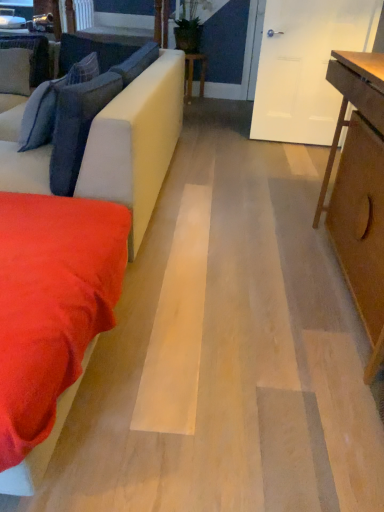
The width and height of the screenshot is (384, 512). I want to click on light brown wooden table at right, marked as the second table in a back-to-front arrangement, so click(x=354, y=102).

This screenshot has width=384, height=512. What do you see at coordinates (31, 54) in the screenshot? I see `suede-like gray pillow at upper left, which is the fourth pillow in front-to-back order` at bounding box center [31, 54].

Find the location of a particular element. The width and height of the screenshot is (384, 512). dark blue fabric pillow at left, arranged as the second pillow when viewed from the front is located at coordinates (51, 104).

Describe the element at coordinates (93, 50) in the screenshot. The image size is (384, 512). I see `velvet blue pillow at upper left, which appears as the third pillow when viewed from the front` at that location.

The image size is (384, 512). What do you see at coordinates (56, 303) in the screenshot?
I see `suede-like red blanket at lower left` at bounding box center [56, 303].

This screenshot has height=512, width=384. I want to click on light brown wooden table at right, marked as the second table in a back-to-front arrangement, so click(354, 102).

Considering the sizes of objects velvet blue pillow at upper left, the second pillow positioned from the back, and dark blue fabric pillow at left, acting as the 3th pillow starting from the back, in the image provided, who is taller, velvet blue pillow at upper left, the second pillow positioned from the back, or dark blue fabric pillow at left, acting as the 3th pillow starting from the back,?

dark blue fabric pillow at left, acting as the 3th pillow starting from the back.

Would you say velvet blue pillow at upper left, the second pillow positioned from the back, is inside or outside dark blue fabric pillow at left, arranged as the second pillow when viewed from the front?

velvet blue pillow at upper left, the second pillow positioned from the back, cannot be found inside dark blue fabric pillow at left, arranged as the second pillow when viewed from the front.

Is velvet blue pillow at upper left, which appears as the third pillow when viewed from the front, looking in the opposite direction of dark blue fabric pillow at left, arranged as the second pillow when viewed from the front?

No, velvet blue pillow at upper left, which appears as the third pillow when viewed from the front, is not facing the opposite direction of dark blue fabric pillow at left, arranged as the second pillow when viewed from the front.

Considering the sizes of objects velvet blue pillow at upper left, which appears as the third pillow when viewed from the front, and dark blue fabric pillow at left, arranged as the second pillow when viewed from the front, in the image provided, who is smaller, velvet blue pillow at upper left, which appears as the third pillow when viewed from the front, or dark blue fabric pillow at left, arranged as the second pillow when viewed from the front,?

Smaller between the two is velvet blue pillow at upper left, which appears as the third pillow when viewed from the front.

From the image's perspective, between suede-like gray pillow at upper left, which is the first pillow in back-to-front order, and velvet blue pillow at upper left, which appears as the third pillow when viewed from the front, who is located below?

velvet blue pillow at upper left, which appears as the third pillow when viewed from the front, from the image's perspective.

Is suede-like gray pillow at upper left, which is the fourth pillow in front-to-back order, facing away from velvet blue pillow at upper left, the second pillow positioned from the back?

suede-like gray pillow at upper left, which is the fourth pillow in front-to-back order, does not have its back to velvet blue pillow at upper left, the second pillow positioned from the back.

Does suede-like gray pillow at upper left, which is the fourth pillow in front-to-back order, have a greater height compared to velvet blue pillow at upper left, which appears as the third pillow when viewed from the front?

Correct, suede-like gray pillow at upper left, which is the fourth pillow in front-to-back order, is much taller as velvet blue pillow at upper left, which appears as the third pillow when viewed from the front.

Is suede-like gray pillow at upper left, which is the fourth pillow in front-to-back order, beside velvet blue pillow at upper left, the second pillow positioned from the back?

No.

Consider the image. Does wooden table at center, which appears as the first table when viewed from the back, have a lesser width compared to dark blue fabric pillow at left, acting as the 3th pillow starting from the back?

In fact, wooden table at center, which appears as the first table when viewed from the back, might be wider than dark blue fabric pillow at left, acting as the 3th pillow starting from the back.

Is there a large distance between wooden table at center, placed as the 2th table when sorted from bottom to top, and dark blue fabric pillow at left, arranged as the second pillow when viewed from the front?

wooden table at center, placed as the 2th table when sorted from bottom to top, is far away from dark blue fabric pillow at left, arranged as the second pillow when viewed from the front.

The height and width of the screenshot is (512, 384). I want to click on pillow that is the 2nd one when counting leftward from the wooden table at center, arranged as the 2th table when viewed from the right, so click(x=51, y=104).

Measure the distance between wooden table at center, which is counted as the 1th table, starting from the left, and dark blue fabric pillow at left, arranged as the second pillow when viewed from the front.

They are 8.31 feet apart.

From a real-world perspective, relative to dark blue fabric pillow at left, acting as the 3th pillow starting from the back, is suede-like red blanket at lower left vertically above or below?

In terms of real-world spatial position, suede-like red blanket at lower left is below dark blue fabric pillow at left, acting as the 3th pillow starting from the back.

Can you confirm if suede-like red blanket at lower left is wider than dark blue fabric pillow at left, arranged as the second pillow when viewed from the front?

Yes, suede-like red blanket at lower left is wider than dark blue fabric pillow at left, arranged as the second pillow when viewed from the front.

Is suede-like red blanket at lower left shorter than dark blue fabric pillow at left, arranged as the second pillow when viewed from the front?

Yes.

Can you confirm if suede-like red blanket at lower left is bigger than dark blue fabric pillow at left, acting as the 3th pillow starting from the back?

Correct, suede-like red blanket at lower left is larger in size than dark blue fabric pillow at left, acting as the 3th pillow starting from the back.

Could you measure the distance between velvety blue pillow at left, acting as the 4th pillow starting from the back, and velvet blue pillow at upper left, which appears as the third pillow when viewed from the front?

velvety blue pillow at left, acting as the 4th pillow starting from the back, and velvet blue pillow at upper left, which appears as the third pillow when viewed from the front, are 5.35 feet apart.

Which is less distant, (51, 161) or (93, 47)?

The point (51, 161) is more forward.

The image size is (384, 512). Identify the location of the 2nd pillow above when counting from the velvety blue pillow at left, acting as the 4th pillow starting from the back (from the image's perspective). (93, 50).

Who is more distant, velvety blue pillow at left, the first pillow in the front-to-back sequence, or velvet blue pillow at upper left, which appears as the third pillow when viewed from the front?

velvet blue pillow at upper left, which appears as the third pillow when viewed from the front, is more distant.

Is dark blue fabric pillow at left, arranged as the second pillow when viewed from the front, at the back of suede-like gray pillow at upper left, which is the fourth pillow in front-to-back order?

No, suede-like gray pillow at upper left, which is the fourth pillow in front-to-back order,'s orientation is not away from dark blue fabric pillow at left, arranged as the second pillow when viewed from the front.

Find the location of a particular element. Image resolution: width=384 pixels, height=512 pixels. the 2nd pillow counting from the left of the dark blue fabric pillow at left, acting as the 3th pillow starting from the back is located at coordinates (31, 54).

Is suede-like gray pillow at upper left, which is the first pillow in back-to-front order, inside or outside of dark blue fabric pillow at left, acting as the 3th pillow starting from the back?

suede-like gray pillow at upper left, which is the first pillow in back-to-front order, cannot be found inside dark blue fabric pillow at left, acting as the 3th pillow starting from the back.

Is suede-like gray pillow at upper left, which is the fourth pillow in front-to-back order, closer to camera compared to dark blue fabric pillow at left, arranged as the second pillow when viewed from the front?

No, the depth of suede-like gray pillow at upper left, which is the fourth pillow in front-to-back order, is greater than that of dark blue fabric pillow at left, arranged as the second pillow when viewed from the front.

Are velvet blue pillow at upper left, the second pillow positioned from the back, and velvety blue pillow at left, acting as the 4th pillow starting from the back, making contact?

There is a gap between velvet blue pillow at upper left, the second pillow positioned from the back, and velvety blue pillow at left, acting as the 4th pillow starting from the back.

Is velvet blue pillow at upper left, the second pillow positioned from the back, to the right of velvety blue pillow at left, acting as the 4th pillow starting from the back, from the viewer's perspective?

Incorrect, velvet blue pillow at upper left, the second pillow positioned from the back, is not on the right side of velvety blue pillow at left, acting as the 4th pillow starting from the back.

Which is in front, point (133, 51) or point (54, 156)?

The point (54, 156) is closer to the camera.

Which is behind, velvet blue pillow at upper left, which appears as the third pillow when viewed from the front, or velvety blue pillow at left, the first pillow in the front-to-back sequence?

Positioned behind is velvet blue pillow at upper left, which appears as the third pillow when viewed from the front.

From the image's perspective, count 1st pillows upward from the dark blue fabric pillow at left, arranged as the second pillow when viewed from the front, and point to it. Please provide its 2D coordinates.

[(93, 50)]

This screenshot has height=512, width=384. Identify the location of pillow that is on the left side of velvet blue pillow at upper left, the second pillow positioned from the back. (31, 54).

Based on their spatial positions, is suede-like gray pillow at upper left, which is the fourth pillow in front-to-back order, or suede-like beige couch at left closer to suede-like red blanket at lower left?

suede-like beige couch at left lies closer to suede-like red blanket at lower left than the other object.

From the image, which object appears to be nearer to velvety blue pillow at left, the first pillow in the front-to-back sequence, suede-like gray pillow at upper left, which is the first pillow in back-to-front order, or velvet blue pillow at upper left, the second pillow positioned from the back?

velvet blue pillow at upper left, the second pillow positioned from the back, lies closer to velvety blue pillow at left, the first pillow in the front-to-back sequence, than the other object.

When comparing their distances from velvety blue pillow at left, acting as the 4th pillow starting from the back, does light brown wooden table at right, marked as the second table in a back-to-front arrangement, or suede-like gray pillow at upper left, which is the fourth pillow in front-to-back order, seem further?

Among the two, suede-like gray pillow at upper left, which is the fourth pillow in front-to-back order, is located further to velvety blue pillow at left, acting as the 4th pillow starting from the back.

When comparing their distances from suede-like red blanket at lower left, does suede-like beige couch at left or velvety blue pillow at left, the first pillow in the front-to-back sequence, seem closer?

The object closer to suede-like red blanket at lower left is velvety blue pillow at left, the first pillow in the front-to-back sequence.

Based on their spatial positions, is suede-like gray pillow at upper left, which is the first pillow in back-to-front order, or dark blue fabric pillow at left, arranged as the second pillow when viewed from the front, further from velvet blue pillow at upper left, the second pillow positioned from the back?

The object further to velvet blue pillow at upper left, the second pillow positioned from the back, is dark blue fabric pillow at left, arranged as the second pillow when viewed from the front.

Based on their spatial positions, is dark blue fabric pillow at left, acting as the 3th pillow starting from the back, or wooden table at center, the second table positioned from the front, closer to velvet blue pillow at upper left, the second pillow positioned from the back?

Based on the image, wooden table at center, the second table positioned from the front, appears to be nearer to velvet blue pillow at upper left, the second pillow positioned from the back.

When comparing their distances from velvety blue pillow at left, acting as the 4th pillow starting from the back, does wooden table at center, placed as the 2th table when sorted from bottom to top, or suede-like beige couch at left seem closer?

suede-like beige couch at left is positioned closer to the anchor velvety blue pillow at left, acting as the 4th pillow starting from the back.

Consider the image. From the image, which object appears to be farther from suede-like gray pillow at upper left, which is the fourth pillow in front-to-back order, dark blue fabric pillow at left, arranged as the second pillow when viewed from the front, or suede-like red blanket at lower left?

The object further to suede-like gray pillow at upper left, which is the fourth pillow in front-to-back order, is suede-like red blanket at lower left.

Find the location of a particular element. This screenshot has width=384, height=512. studio couch positioned between light brown wooden table at right, which appears as the second table when viewed from the left, and wooden table at center, which appears as the first table when viewed from the back, from near to far is located at coordinates (136, 143).

Identify the location of pillow positioned between suede-like red blanket at lower left and dark blue fabric pillow at left, arranged as the second pillow when viewed from the front, from near to far. (77, 127).

This screenshot has width=384, height=512. Find the location of `studio couch positioned between suede-like red blanket at lower left and velvet blue pillow at upper left, which appears as the third pillow when viewed from the front, from near to far`. studio couch positioned between suede-like red blanket at lower left and velvet blue pillow at upper left, which appears as the third pillow when viewed from the front, from near to far is located at coordinates tap(136, 143).

Identify the location of studio couch between light brown wooden table at right, marked as the second table in a back-to-front arrangement, and velvet blue pillow at upper left, the second pillow positioned from the back, from front to back. (136, 143).